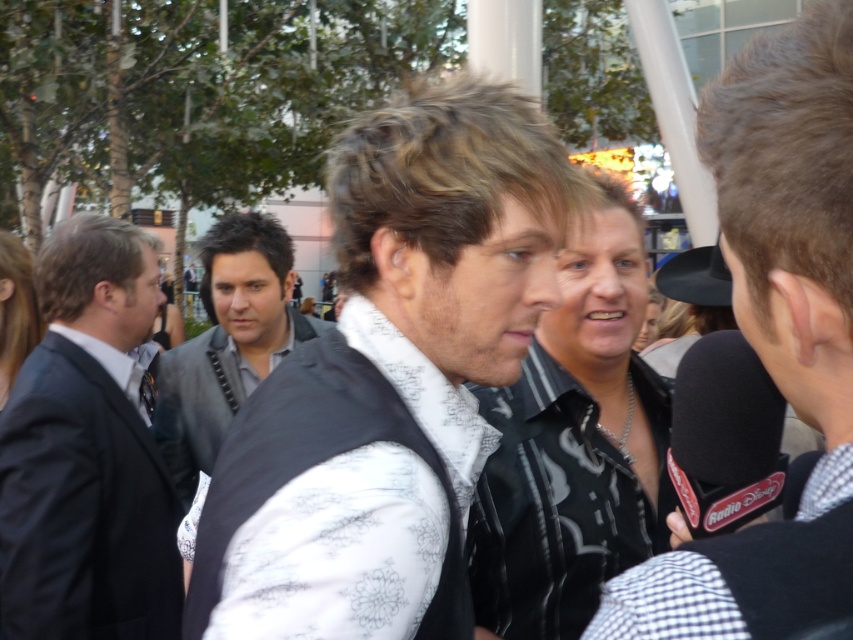
Question: Can you confirm if white textured vest at center is bigger than black leather jacket at center?

Choices:
 (A) no
 (B) yes

Answer: (B)

Question: In this image, where is black leather jacket at center located relative to dark gray textured vest at center?

Choices:
 (A) left
 (B) right

Answer: (B)

Question: Which object is closer to the camera taking this photo?

Choices:
 (A) white textured vest at center
 (B) white floral vest at center
 (C) dark gray textured vest at center

Answer: (B)

Question: Is white textured vest at center bigger than dark gray suit at left?

Choices:
 (A) no
 (B) yes

Answer: (A)

Question: Which point is closer to the camera taking this photo?

Choices:
 (A) (838, 520)
 (B) (456, 404)
 (C) (206, 257)

Answer: (A)

Question: Which point is closer to the camera taking this photo?

Choices:
 (A) (112, 444)
 (B) (357, 122)
 (C) (396, 388)
 (D) (699, 636)

Answer: (D)